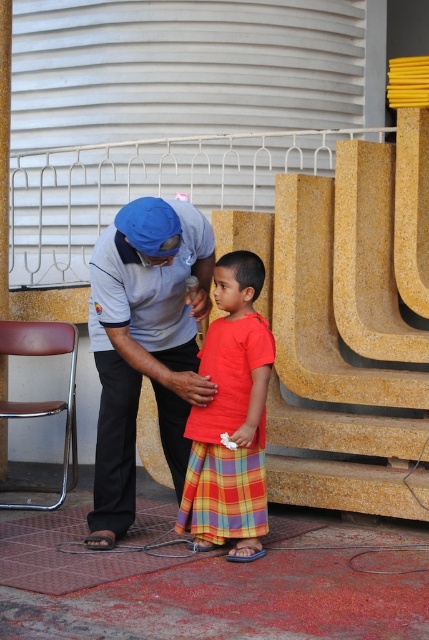
Is point (224, 486) positioned before point (211, 468)?

Yes, point (224, 486) is in front of point (211, 468).

Between red plaid skirt at center and plaid cotton kilt at center, which one appears on the right side from the viewer's perspective?

red plaid skirt at center is more to the right.

Which is in front, point (189, 504) or point (247, 513)?

Point (247, 513) is more forward.

I want to click on red plaid skirt at center, so click(x=230, y=419).

Is matte blue cap at center below plaid cotton kilt at center?

Actually, matte blue cap at center is above plaid cotton kilt at center.

Which is behind, point (111, 532) or point (198, 522)?

Positioned behind is point (111, 532).

Who is more forward, (120,460) or (199,506)?

Point (199,506) is in front.

In order to click on matte blue cap at center in this screenshot , I will do `click(145, 344)`.

Who is positioned more to the left, matte blue cap at center or red plaid skirt at center?

matte blue cap at center is more to the left.

Who is more distant from viewer, (171, 440) or (223, 340)?

Positioned behind is point (171, 440).

What do you see at coordinates (145, 344) in the screenshot? The height and width of the screenshot is (640, 429). I see `matte blue cap at center` at bounding box center [145, 344].

Where is `matte blue cap at center`? This screenshot has height=640, width=429. matte blue cap at center is located at coordinates (145, 344).